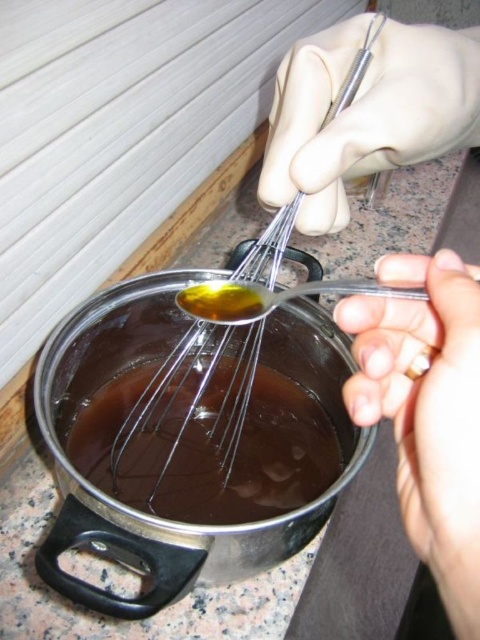
You are a chef preparing a sauce and notice the white latex glove at upper center and the metallic whisk at center. Which object is covering the other?

The white latex glove at upper center is positioned over the metallic whisk at center, so it is covering it.